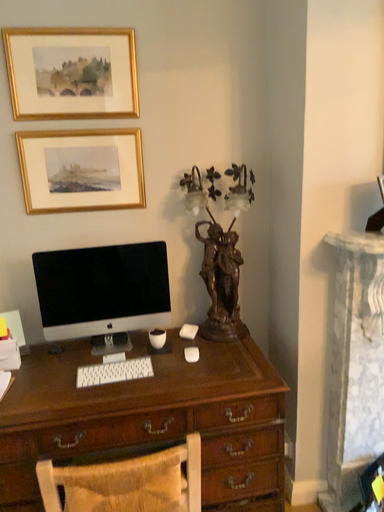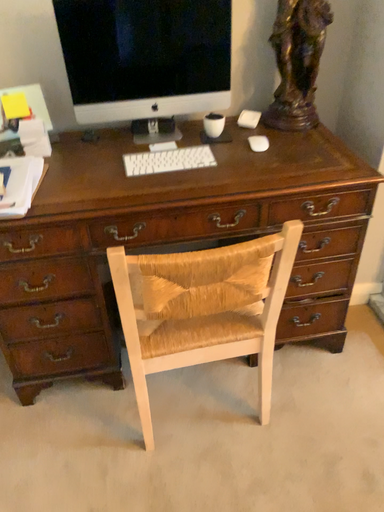
Question: How did the camera likely rotate when shooting the video?

Choices:
 (A) rotated downward
 (B) rotated upward

Answer: (A)